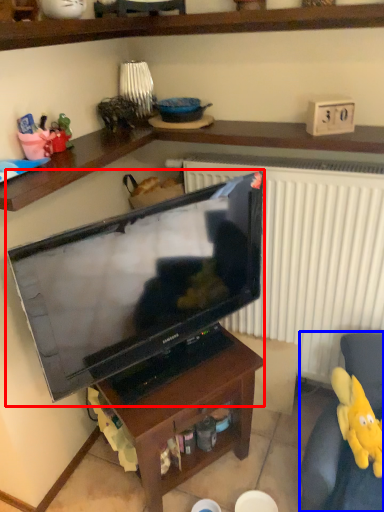
Question: Among these objects, which one is farthest to the camera, television (highlighted by a red box) or swivel chair (highlighted by a blue box)?

Choices:
 (A) television
 (B) swivel chair

Answer: (B)